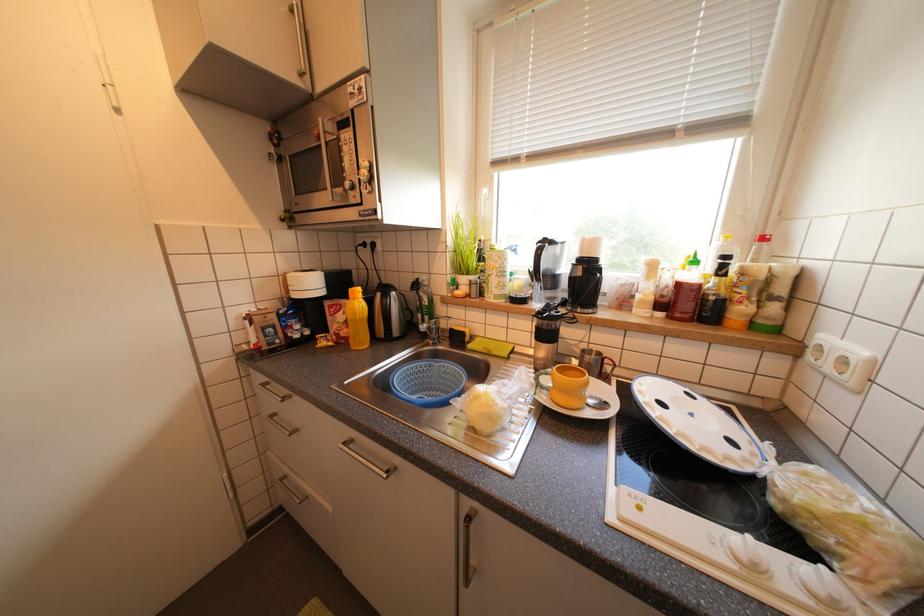
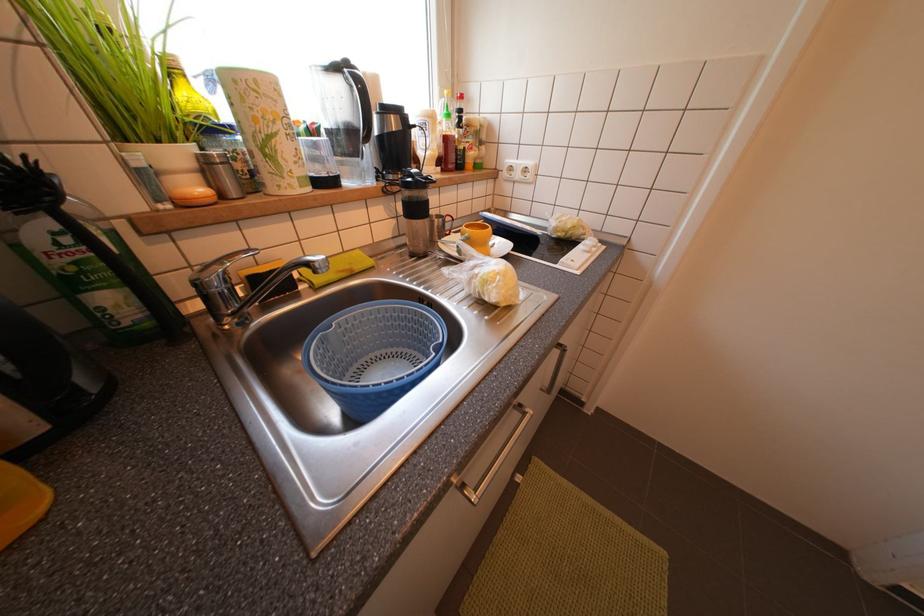
First-person continuous shooting, in which direction is the camera rotating?

The camera rotated toward right-down.